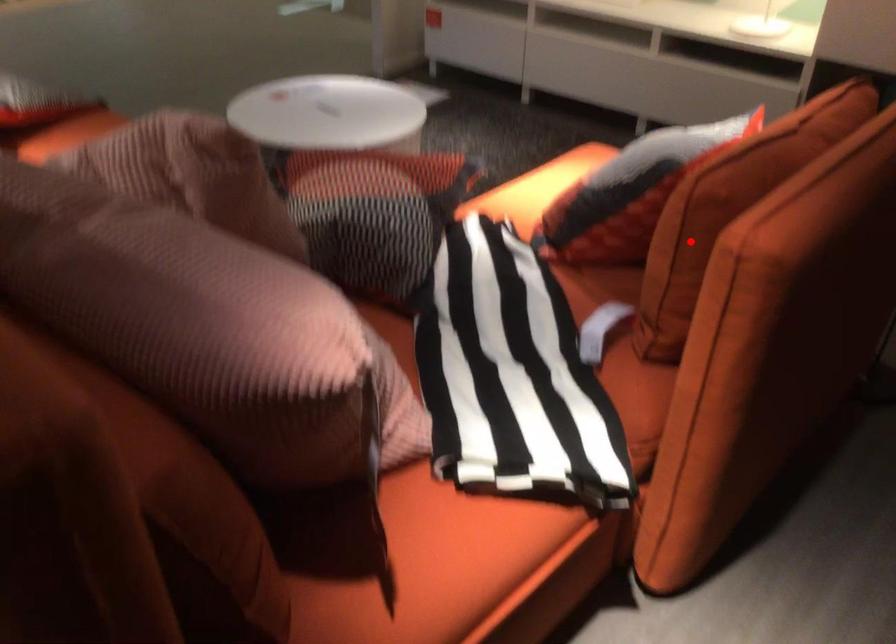
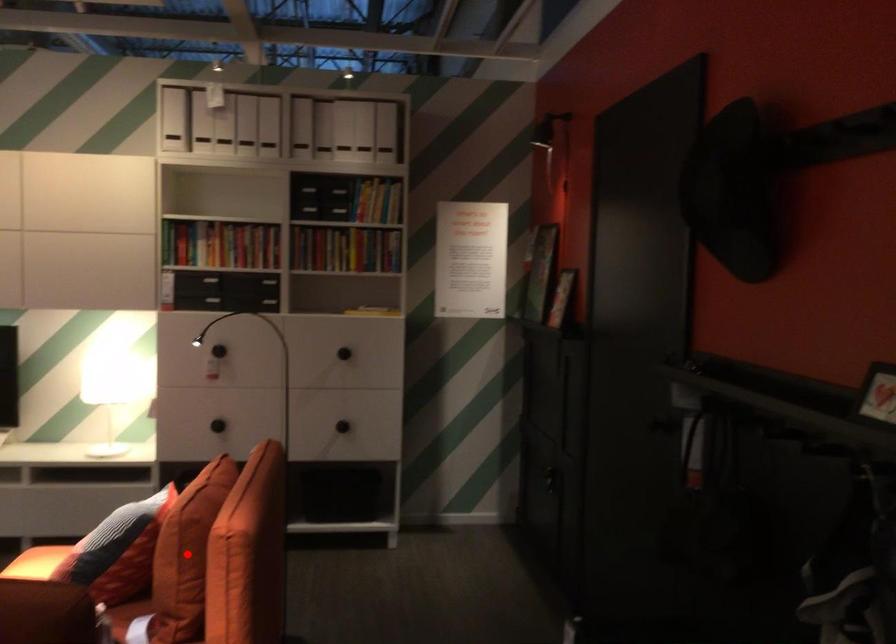
I am providing you with two images of the same scene from different viewpoints. A red point is marked on the first image and another point is marked on the second image. Is the marked point in image1 the same physical position as the marked point in image2?

Yes